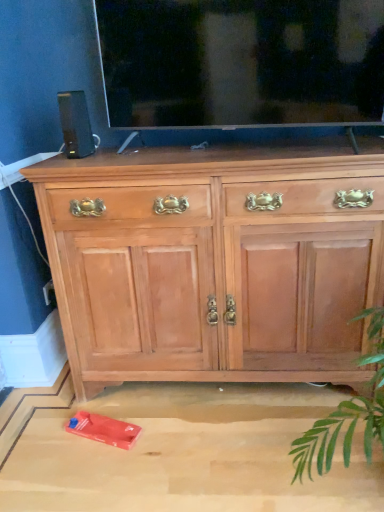
Question: Is transparent glass tv at upper center taller or shorter than light wood cabinet at center?

Choices:
 (A) tall
 (B) short

Answer: (B)

Question: From the image's perspective, relative to light wood cabinet at center, is transparent glass tv at upper center above or below?

Choices:
 (A) below
 (B) above

Answer: (B)

Question: Which is nearer to the black plastic speaker at upper left?

Choices:
 (A) light wood cabinet at center
 (B) transparent glass tv at upper center

Answer: (B)

Question: Estimate the real-world distances between objects in this image. Which object is closer to the transparent glass tv at upper center?

Choices:
 (A) light wood cabinet at center
 (B) black plastic speaker at upper left

Answer: (B)